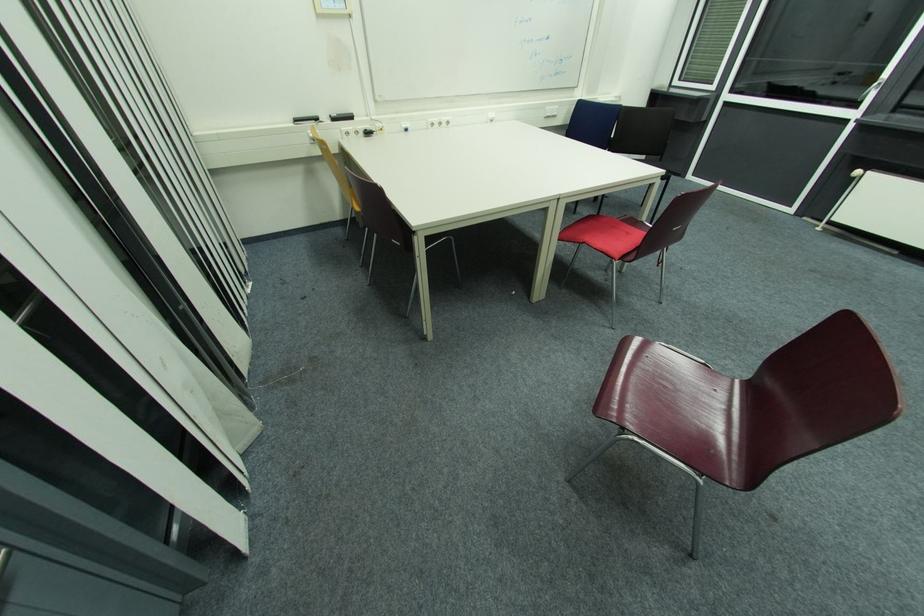
Find where to sit the red chair sitting surface. Please return your answer as a coordinate pair (x, y).

(611, 235)